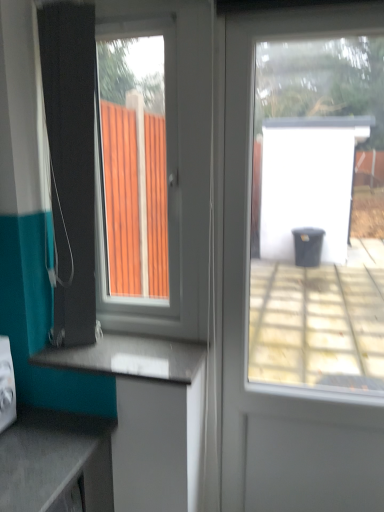
Locate an element on the screen. This screenshot has height=512, width=384. free space to the right of teal fabric shower curtain at left is located at coordinates (148, 353).